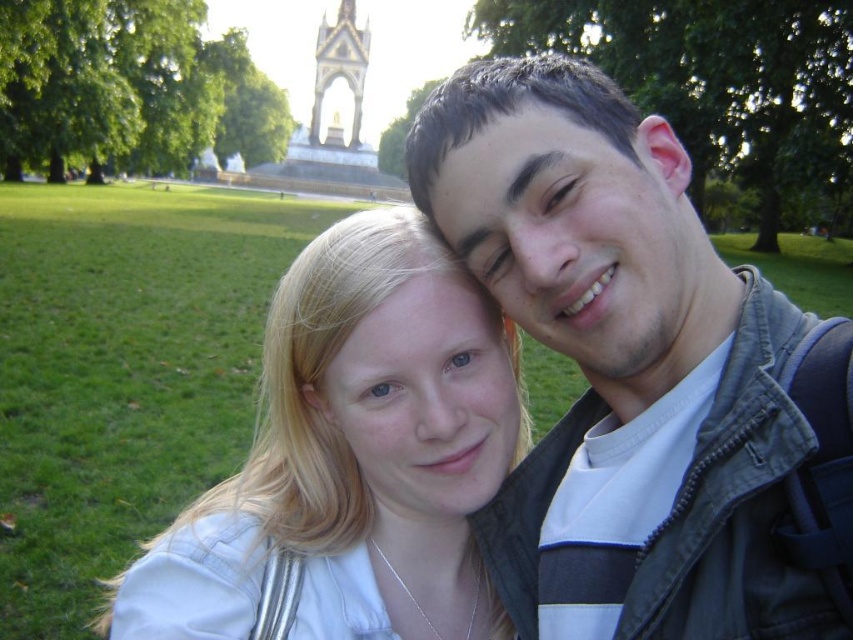
Does dark green jacket at center have a greater width compared to bronze statue at upper center?

Indeed, dark green jacket at center has a greater width compared to bronze statue at upper center.

Does point (540, 60) come in front of point (352, 12)?

That is True.

Image resolution: width=853 pixels, height=640 pixels. What do you see at coordinates (640, 374) in the screenshot?
I see `dark green jacket at center` at bounding box center [640, 374].

Where is `dark green jacket at center`? The image size is (853, 640). dark green jacket at center is located at coordinates (640, 374).

Can you confirm if white fabric at center is positioned below bronze statue at upper center?

Yes.

Is white fabric at center wider than bronze statue at upper center?

Correct, the width of white fabric at center exceeds that of bronze statue at upper center.

Image resolution: width=853 pixels, height=640 pixels. What do you see at coordinates (352, 458) in the screenshot?
I see `white fabric at center` at bounding box center [352, 458].

The height and width of the screenshot is (640, 853). I want to click on white fabric at center, so click(352, 458).

Does dark green jacket at center come behind white fabric at center?

That is False.

Does point (549, 481) come closer to viewer compared to point (328, 426)?

Yes, it is in front of point (328, 426).

Is point (624, 499) positioned in front of point (498, 442)?

Yes.

Where is `dark green jacket at center`? This screenshot has height=640, width=853. dark green jacket at center is located at coordinates pos(640,374).